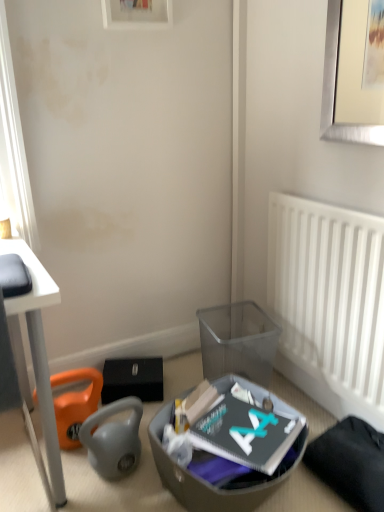
The image size is (384, 512). What are the coordinates of `white plastic radiator at right` in the screenshot? It's located at (329, 303).

At what (x,y) coordinates should I click in order to perform the action: click on orange fabric bean bag chair at lower left. Please return your answer as a coordinate pair (x, y). This screenshot has height=512, width=384. Looking at the image, I should click on (75, 404).

Measure the distance between point (163, 480) and camera.

Point (163, 480) and camera are 1.34 meters apart from each other.

Measure the distance between point (118, 5) and camera.

Point (118, 5) is 4.90 feet away from camera.

Find the location of a particular element. white plastic radiator at right is located at coordinates (x=329, y=303).

Is point (138, 18) positioned in front of point (247, 306)?

Yes, point (138, 18) is closer to viewer.

From a real-world perspective, is wooden picture frame at upper center beneath transparent plastic trash bin/can at lower center?

No, from a real-world perspective, wooden picture frame at upper center is not below transparent plastic trash bin/can at lower center.

Based on their sizes in the image, would you say wooden picture frame at upper center is bigger or smaller than transparent plastic trash bin/can at lower center?

wooden picture frame at upper center is smaller than transparent plastic trash bin/can at lower center.

Could you tell me if wooden picture frame at upper center is turned towards transparent plastic trash bin/can at lower center?

No, wooden picture frame at upper center is not oriented towards transparent plastic trash bin/can at lower center.

The width and height of the screenshot is (384, 512). Identify the location of bean bag chair that is on the left side of translucent plastic shoe box at lower center. (75, 404).

From the image's perspective, which is above, orange fabric bean bag chair at lower left or translucent plastic shoe box at lower center?

orange fabric bean bag chair at lower left is shown above in the image.

Based on the photo, is the depth of orange fabric bean bag chair at lower left less than that of translucent plastic shoe box at lower center?

No, orange fabric bean bag chair at lower left is further to the viewer.

Can we say orange fabric bean bag chair at lower left lies outside translucent plastic shoe box at lower center?

Yes, orange fabric bean bag chair at lower left is not within translucent plastic shoe box at lower center.

Does orange fabric bean bag chair at lower left come behind wooden picture frame at upper center?

Yes, orange fabric bean bag chair at lower left is behind wooden picture frame at upper center.

Is orange fabric bean bag chair at lower left placed right next to wooden picture frame at upper center?

No, orange fabric bean bag chair at lower left is not touching wooden picture frame at upper center.

Does point (72, 426) come farther from viewer compared to point (145, 16)?

No, (72, 426) is closer to viewer.

From a real-world perspective, which is physically above, orange fabric bean bag chair at lower left or wooden picture frame at upper center?

In real-world perspective, wooden picture frame at upper center is above.

Is orange fabric bean bag chair at lower left closer to the viewer compared to transparent plastic trash bin/can at lower center?

Yes, it is.

Which object is positioned more to the left, orange fabric bean bag chair at lower left or transparent plastic trash bin/can at lower center?

From the viewer's perspective, orange fabric bean bag chair at lower left appears more on the left side.

From the image's perspective, does orange fabric bean bag chair at lower left appear lower than transparent plastic trash bin/can at lower center?

Yes.

Is translucent plastic shoe box at lower center in contact with orange fabric bean bag chair at lower left?

translucent plastic shoe box at lower center and orange fabric bean bag chair at lower left are clearly separated.

From a real-world perspective, is translucent plastic shoe box at lower center on top of orange fabric bean bag chair at lower left?

No.

Is orange fabric bean bag chair at lower left located within translucent plastic shoe box at lower center?

Definitely not — orange fabric bean bag chair at lower left is not inside translucent plastic shoe box at lower center.

Which is nearer, (210, 388) or (86, 396)?

The point (210, 388) is in front.

Is transparent plastic trash bin/can at lower center directly adjacent to orange fabric bean bag chair at lower left?

There is a gap between transparent plastic trash bin/can at lower center and orange fabric bean bag chair at lower left.

Is orange fabric bean bag chair at lower left located within transparent plastic trash bin/can at lower center?

That's incorrect, orange fabric bean bag chair at lower left is not inside transparent plastic trash bin/can at lower center.

Is transparent plastic trash bin/can at lower center closer to the viewer compared to orange fabric bean bag chair at lower left?

No, it is not.

From the image's perspective, relative to orange fabric bean bag chair at lower left, is transparent plastic trash bin/can at lower center above or below?

Based on their image positions, transparent plastic trash bin/can at lower center is located above orange fabric bean bag chair at lower left.

From a real-world perspective, is transparent plastic trash bin/can at lower center located beneath wooden picture frame at upper center?

Yes, from a real-world perspective, transparent plastic trash bin/can at lower center is below wooden picture frame at upper center.

Is transparent plastic trash bin/can at lower center oriented away from wooden picture frame at upper center?

No, transparent plastic trash bin/can at lower center is not facing away from wooden picture frame at upper center.

Which of these two, transparent plastic trash bin/can at lower center or wooden picture frame at upper center, stands taller?

Standing taller between the two is transparent plastic trash bin/can at lower center.

At what (x,y) coordinates should I click in order to perform the action: click on trash bin/can below the wooden picture frame at upper center (from a real-world perspective). Please return your answer as a coordinate pair (x, y). The height and width of the screenshot is (512, 384). Looking at the image, I should click on (238, 341).

Where is `shoe box located on the right of orange fabric bean bag chair at lower left`? shoe box located on the right of orange fabric bean bag chair at lower left is located at coordinates (233, 446).

Considering their positions, is transparent plastic trash bin/can at lower center positioned further to white plastic radiator at right than orange fabric bean bag chair at lower left?

Based on the image, orange fabric bean bag chair at lower left appears to be further to white plastic radiator at right.

Looking at the image, which one is located further to wooden picture frame at upper center, white plastic radiator at right or orange fabric bean bag chair at lower left?

orange fabric bean bag chair at lower left.

Considering their positions, is orange fabric bean bag chair at lower left positioned closer to translucent plastic shoe box at lower center than transparent plastic trash bin/can at lower center?

transparent plastic trash bin/can at lower center is closer to translucent plastic shoe box at lower center.

Looking at the image, which one is located closer to translucent plastic shoe box at lower center, transparent plastic trash bin/can at lower center or orange fabric bean bag chair at lower left?

Based on the image, transparent plastic trash bin/can at lower center appears to be nearer to translucent plastic shoe box at lower center.

Which object lies further to the anchor point white plastic radiator at right, wooden picture frame at upper center or transparent plastic trash bin/can at lower center?

wooden picture frame at upper center lies further to white plastic radiator at right than the other object.

From the picture: Based on their spatial positions, is wooden picture frame at upper center or transparent plastic trash bin/can at lower center further from translucent plastic shoe box at lower center?

wooden picture frame at upper center lies further to translucent plastic shoe box at lower center than the other object.

Based on their spatial positions, is orange fabric bean bag chair at lower left or white plastic radiator at right closer to translucent plastic shoe box at lower center?

The object closer to translucent plastic shoe box at lower center is white plastic radiator at right.

Considering their positions, is orange fabric bean bag chair at lower left positioned closer to translucent plastic shoe box at lower center than wooden picture frame at upper center?

orange fabric bean bag chair at lower left lies closer to translucent plastic shoe box at lower center than the other object.

Where is `radiator between wooden picture frame at upper center and orange fabric bean bag chair at lower left vertically`? The height and width of the screenshot is (512, 384). radiator between wooden picture frame at upper center and orange fabric bean bag chair at lower left vertically is located at coordinates (329, 303).

Locate an element on the screen. This screenshot has height=512, width=384. radiator between translucent plastic shoe box at lower center and transparent plastic trash bin/can at lower center from front to back is located at coordinates (329, 303).

The image size is (384, 512). I want to click on bean bag chair between wooden picture frame at upper center and translucent plastic shoe box at lower center from top to bottom, so click(x=75, y=404).

Locate an element on the screen. The image size is (384, 512). trash bin/can between wooden picture frame at upper center and translucent plastic shoe box at lower center in the vertical direction is located at coordinates (238, 341).